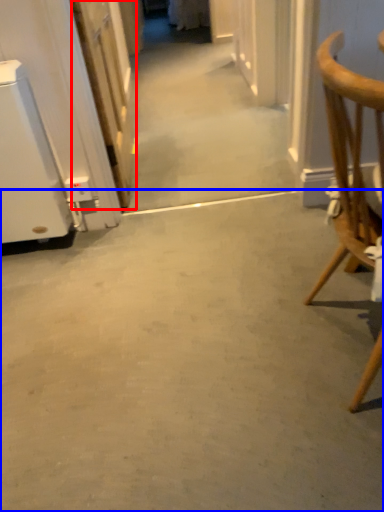
Question: Which object is further to the camera taking this photo, door (highlighted by a red box) or concrete (highlighted by a blue box)?

Choices:
 (A) door
 (B) concrete

Answer: (A)